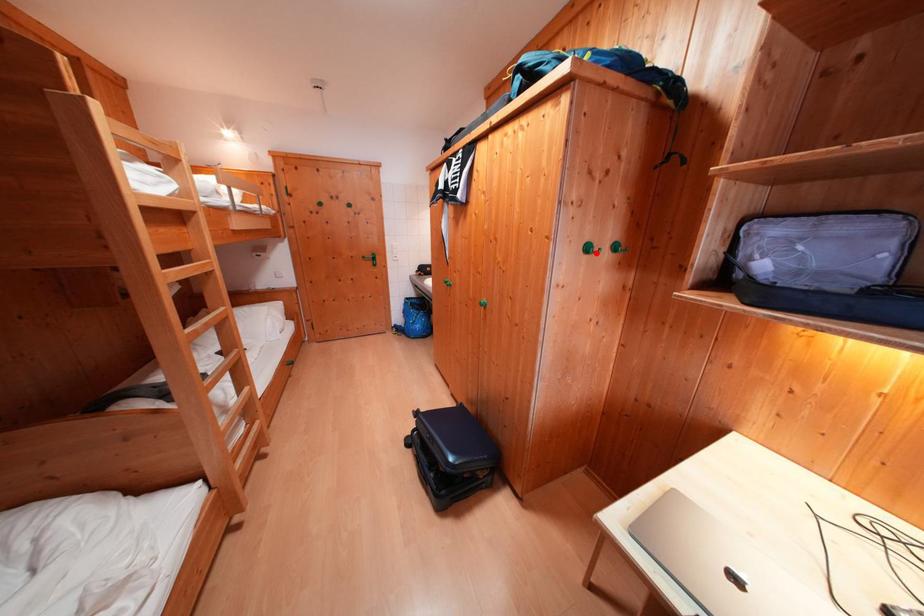
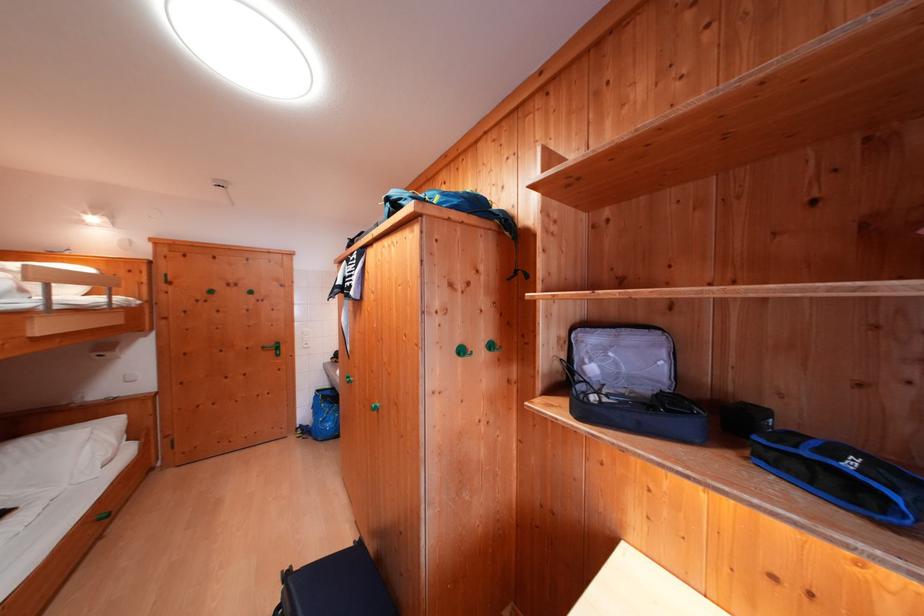
Where in the second image is the point corresponding to the highlighted location from the first image?

(469, 355)